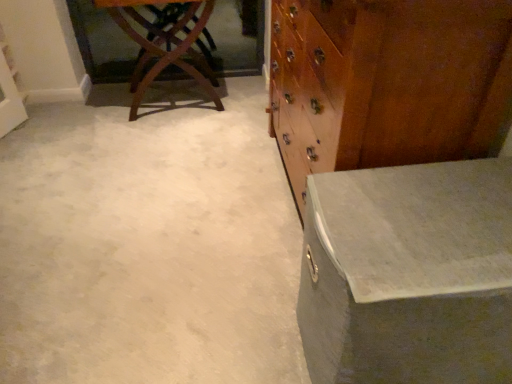
Question: From a real-world perspective, is mahogany wood table at upper left, which appears as the first table when viewed from the back, on matte gray trunk at right, arranged as the first table when ordered from the bottom?

Choices:
 (A) yes
 (B) no

Answer: (A)

Question: Is mahogany wood table at upper left, which ranks as the 1th table in left-to-right order, positioned with its back to matte gray trunk at right, arranged as the first table when ordered from the bottom?

Choices:
 (A) no
 (B) yes

Answer: (A)

Question: Can you confirm if mahogany wood table at upper left, acting as the second table starting from the bottom, is positioned to the right of matte gray trunk at right, arranged as the first table when ordered from the bottom?

Choices:
 (A) yes
 (B) no

Answer: (B)

Question: Would you consider mahogany wood table at upper left, the 2th table when ordered from right to left, to be distant from matte gray trunk at right, which is the first table in front-to-back order?

Choices:
 (A) no
 (B) yes

Answer: (B)

Question: Is mahogany wood table at upper left, which is the first table in top-to-bottom order, smaller than matte gray trunk at right, placed as the 2th table when sorted from top to bottom?

Choices:
 (A) yes
 (B) no

Answer: (B)

Question: From a real-world perspective, is mahogany wood table at upper left, which appears as the second table when viewed from the front, under matte gray trunk at right, the 1th table from the right?

Choices:
 (A) yes
 (B) no

Answer: (B)

Question: From the image's perspective, is wooden chest of drawers at right beneath matte gray trunk at right, which appears as the second table when viewed from the left?

Choices:
 (A) no
 (B) yes

Answer: (A)

Question: Considering the relative positions of wooden chest of drawers at right and matte gray trunk at right, the 1th table from the right, in the image provided, is wooden chest of drawers at right to the right of matte gray trunk at right, the 1th table from the right, from the viewer's perspective?

Choices:
 (A) no
 (B) yes

Answer: (A)

Question: Is wooden chest of drawers at right further to camera compared to matte gray trunk at right, arranged as the 2th table when viewed from the back?

Choices:
 (A) yes
 (B) no

Answer: (A)

Question: Does wooden chest of drawers at right have a greater height compared to matte gray trunk at right, arranged as the 2th table when viewed from the back?

Choices:
 (A) no
 (B) yes

Answer: (B)

Question: Can you confirm if wooden chest of drawers at right is shorter than matte gray trunk at right, arranged as the 2th table when viewed from the back?

Choices:
 (A) no
 (B) yes

Answer: (A)

Question: Does wooden chest of drawers at right have a lesser width compared to matte gray trunk at right, which is the first table in front-to-back order?

Choices:
 (A) no
 (B) yes

Answer: (B)

Question: Is wooden chest of drawers at right at the back of matte gray trunk at right, which appears as the second table when viewed from the left?

Choices:
 (A) yes
 (B) no

Answer: (B)